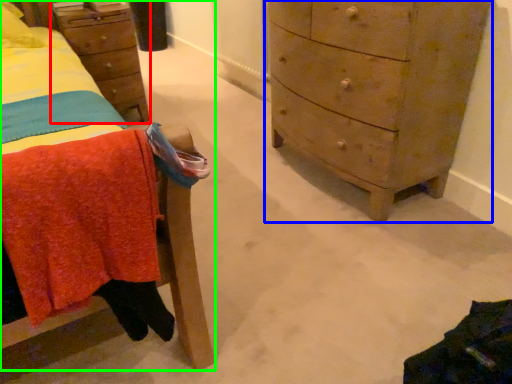
Question: Which object is positioned farthest from nightstand (highlighted by a red box)? Select from chest of drawers (highlighted by a blue box) and furniture (highlighted by a green box).

Choices:
 (A) chest of drawers
 (B) furniture

Answer: (A)